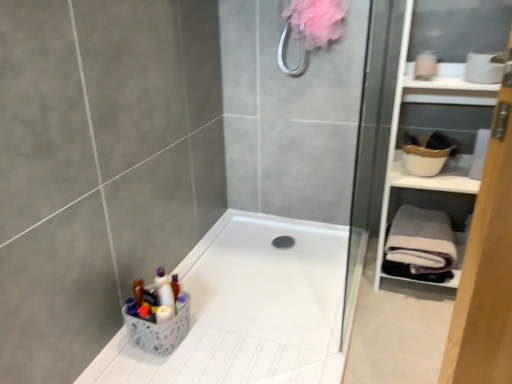
Question: From a real-world perspective, is white matte cabinet at right under white plastic basket at lower left?

Choices:
 (A) no
 (B) yes

Answer: (A)

Question: Is the position of white matte cabinet at right less distant than that of white plastic basket at lower left?

Choices:
 (A) no
 (B) yes

Answer: (B)

Question: Can you confirm if white matte cabinet at right is taller than white plastic basket at lower left?

Choices:
 (A) no
 (B) yes

Answer: (B)

Question: Is white matte cabinet at right not near white plastic basket at lower left?

Choices:
 (A) no
 (B) yes

Answer: (B)

Question: Does white matte cabinet at right have a greater width compared to white plastic basket at lower left?

Choices:
 (A) yes
 (B) no

Answer: (A)

Question: From the image's perspective, is white plastic basket at lower left located above or below gray fleece bath towel at right?

Choices:
 (A) above
 (B) below

Answer: (B)

Question: In terms of size, does white plastic basket at lower left appear bigger or smaller than gray fleece bath towel at right?

Choices:
 (A) big
 (B) small

Answer: (B)

Question: In the image, is white plastic basket at lower left positioned in front of or behind gray fleece bath towel at right?

Choices:
 (A) front
 (B) behind

Answer: (A)

Question: Is white plastic basket at lower left inside the boundaries of gray fleece bath towel at right, or outside?

Choices:
 (A) outside
 (B) inside

Answer: (A)

Question: Based on their sizes in the image, would you say gray fleece bath towel at right is bigger or smaller than white matte cabinet at right?

Choices:
 (A) big
 (B) small

Answer: (B)

Question: From a real-world perspective, is gray fleece bath towel at right positioned above or below white matte cabinet at right?

Choices:
 (A) below
 (B) above

Answer: (A)

Question: From the image's perspective, is gray fleece bath towel at right located above or below white matte cabinet at right?

Choices:
 (A) above
 (B) below

Answer: (B)

Question: In terms of height, does gray fleece bath towel at right look taller or shorter compared to white matte cabinet at right?

Choices:
 (A) tall
 (B) short

Answer: (B)

Question: Is white plastic basket at lower left in front of or behind white plastic bathtub at lower left in the image?

Choices:
 (A) behind
 (B) front

Answer: (A)

Question: Is point (143, 345) closer or farther from the camera than point (279, 354)?

Choices:
 (A) farther
 (B) closer

Answer: (A)